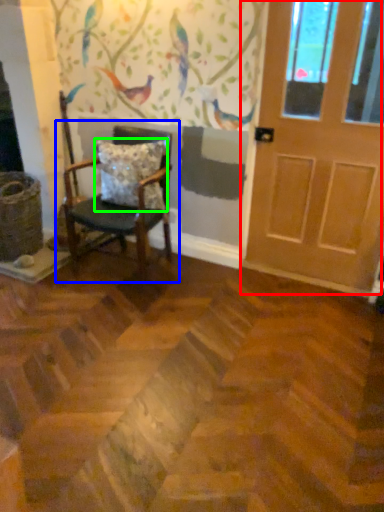
Question: Which is farther away from door (highlighted by a red box)? chair (highlighted by a blue box) or pillow (highlighted by a green box)?

Choices:
 (A) chair
 (B) pillow

Answer: (A)